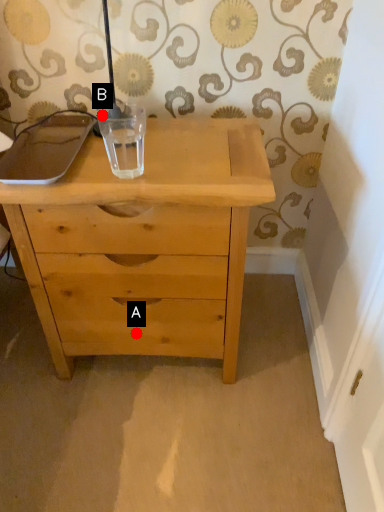
Question: Two points are circled on the image, labeled by A and B beside each circle. Which point is closer to the camera?

Choices:
 (A) A is closer
 (B) B is closer

Answer: (B)